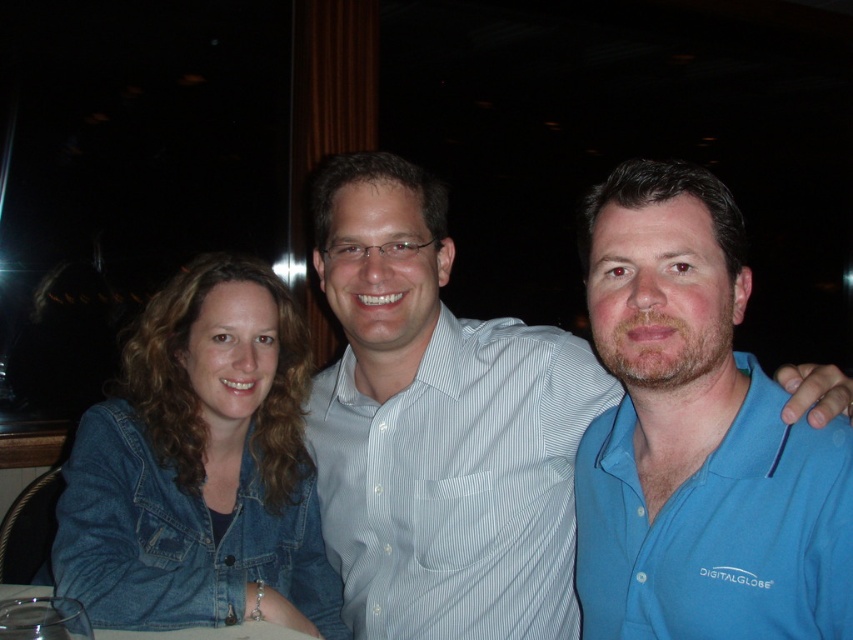
Which is more to the right, blue cotton polo at right or transparent glass at lower left?

blue cotton polo at right is more to the right.

Does point (695, 513) lie in front of point (49, 598)?

Yes, it is.

Does point (619, 531) lie in front of point (74, 602)?

That is False.

This screenshot has height=640, width=853. In order to click on blue cotton polo at right in this screenshot , I will do `click(718, 531)`.

Which is more to the left, light blue shirt at center or denim jacket at center?

Positioned to the left is denim jacket at center.

Measure the distance from light blue shirt at center to denim jacket at center.

They are 8.36 inches apart.

Find the location of `light blue shirt at center`. light blue shirt at center is located at coordinates (438, 426).

Is denim jacket at center wider than white striped shirt at center?

No, denim jacket at center is not wider than white striped shirt at center.

At what (x,y) coordinates should I click in order to perform the action: click on denim jacket at center. Please return your answer as a coordinate pair (x, y). The height and width of the screenshot is (640, 853). Looking at the image, I should click on (x=199, y=465).

You are a GUI agent. You are given a task and a screenshot of the screen. Output one action in this format:
    pyautogui.click(x=<x>, y=<y>)
    Task: Click on the denim jacket at center
    The width and height of the screenshot is (853, 640).
    Given the screenshot: What is the action you would take?
    pyautogui.click(x=199, y=465)